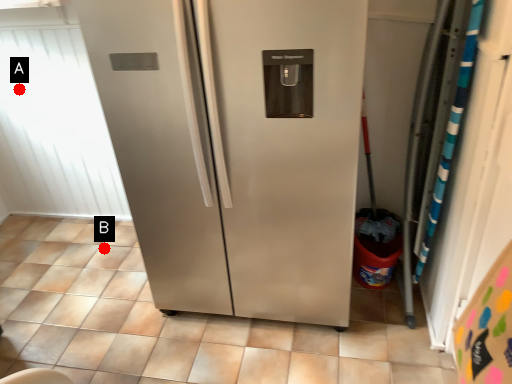
Question: Two points are circled on the image, labeled by A and B beside each circle. Among these points, which one is nearest to the camera?

Choices:
 (A) A is closer
 (B) B is closer

Answer: (A)